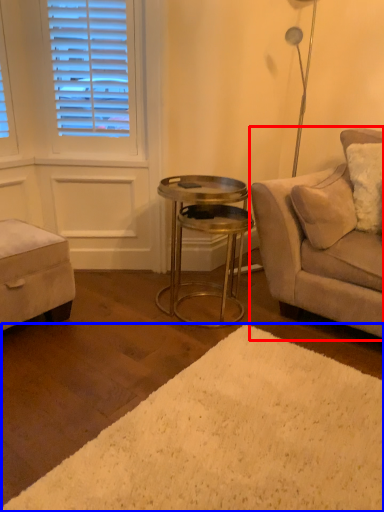
Question: Which object is further to the camera taking this photo, studio couch (highlighted by a red box) or plain (highlighted by a blue box)?

Choices:
 (A) studio couch
 (B) plain

Answer: (A)